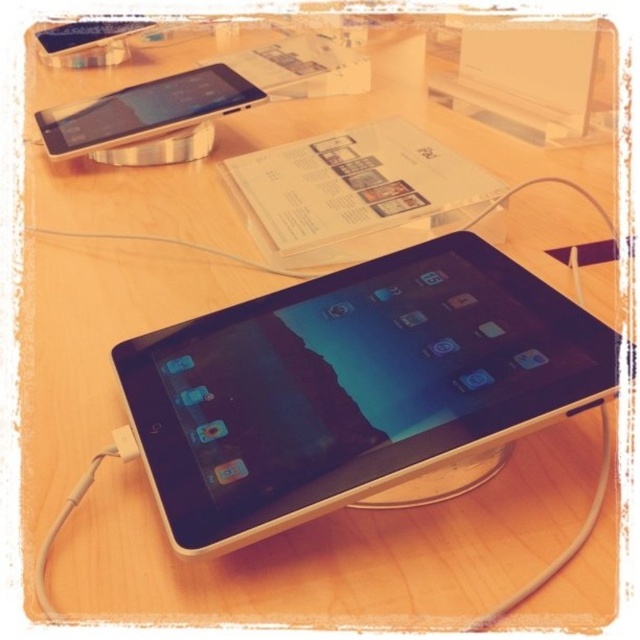
Question: Is satin silver phone at upper left above satin silver ipod at upper left?

Choices:
 (A) no
 (B) yes

Answer: (A)

Question: Which point is closer to the camera?

Choices:
 (A) satin silver ipod at upper left
 (B) black glossy tablet at center
 (C) satin silver phone at upper left

Answer: (B)

Question: Does black glossy tablet at center appear over satin silver phone at upper left?

Choices:
 (A) yes
 (B) no

Answer: (B)

Question: Estimate the real-world distances between objects in this image. Which object is closer to the black glossy tablet at center?

Choices:
 (A) satin silver phone at upper left
 (B) satin silver ipod at upper left

Answer: (A)

Question: Can you confirm if satin silver phone at upper left is positioned to the left of satin silver ipod at upper left?

Choices:
 (A) no
 (B) yes

Answer: (A)

Question: Which point appears farthest from the camera in this image?

Choices:
 (A) (108, 29)
 (B) (122, 125)
 (C) (220, 330)

Answer: (A)